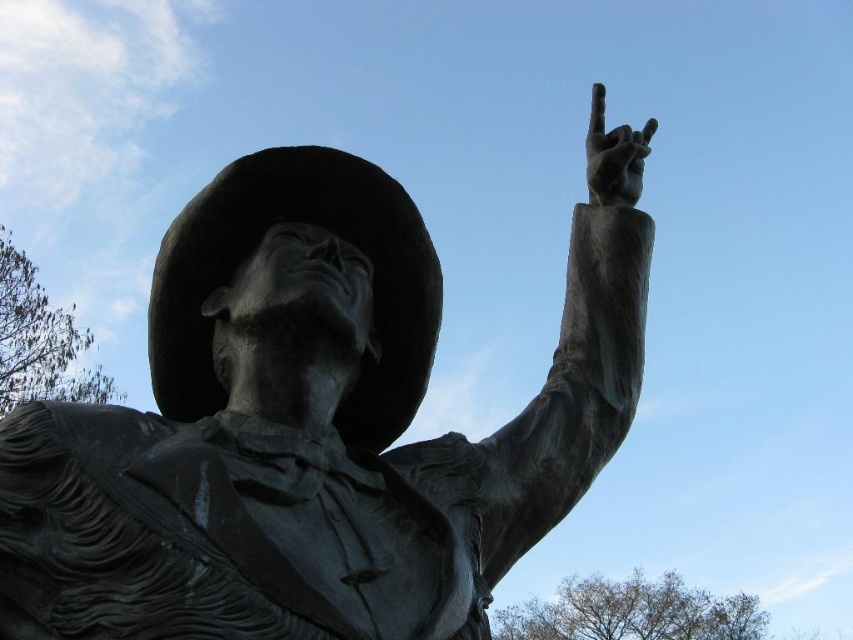
Who is higher up, bronze statue at upper center or bronze hand at upper right?

bronze hand at upper right is above.

Between point (521, 435) and point (598, 92), which one is positioned behind?

Point (598, 92)

Between point (292, 468) and point (621, 193), which one is positioned in front?

Point (292, 468)

Where is `bronze statue at upper center`? bronze statue at upper center is located at coordinates (308, 429).